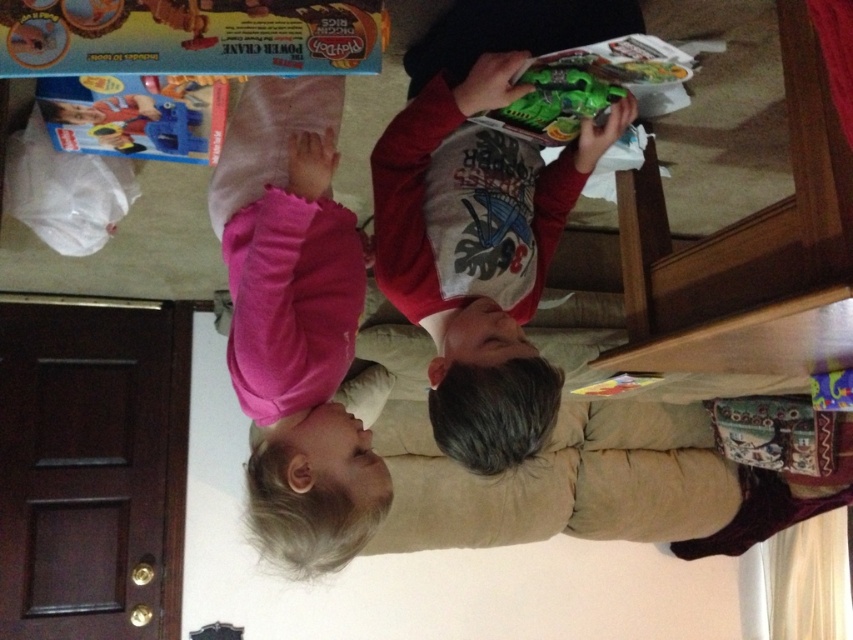
Which of these two, pink soft fabric at lower left or green matte toy gun at upper center, stands taller?

With more height is pink soft fabric at lower left.

How distant is pink soft fabric at lower left from green matte toy gun at upper center?

They are 17.00 inches apart.

Which is behind, point (276, 108) or point (575, 120)?

The point (575, 120) is behind.

Where is `pink soft fabric at lower left`? pink soft fabric at lower left is located at coordinates (294, 323).

From the picture: Which is more to the right, pink soft fabric at lower left or matte red shirt at center?

matte red shirt at center is more to the right.

Does point (323, 433) come in front of point (502, 144)?

Yes, it is.

This screenshot has width=853, height=640. What are the coordinates of `pink soft fabric at lower left` in the screenshot? It's located at (294, 323).

Does point (479, 280) come behind point (593, 99)?

Yes.

Locate an element on the screen. matte red shirt at center is located at coordinates (479, 253).